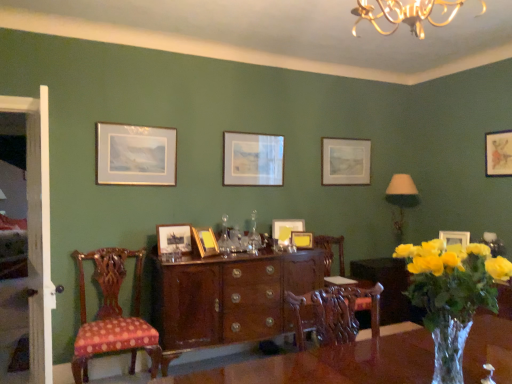
Question: In terms of size, does mahogany wood chair at center, acting as the second chair starting from the front, appear bigger or smaller than matte gold picture frame at upper right, the ninth picture frame from the left?

Choices:
 (A) small
 (B) big

Answer: (B)

Question: Is mahogany wood chair at center, the first chair viewed from the back, inside the boundaries of matte gold picture frame at upper right, the first picture frame viewed from the right, or outside?

Choices:
 (A) outside
 (B) inside

Answer: (A)

Question: Which object is positioned closest to the white wooden door at left?

Choices:
 (A) matte gold picture frame at upper right, the ninth picture frame from the left
 (B) matte silver picture frame at center, marked as the seventh picture frame in a left-to-right arrangement
 (C) wooden picture frame at center, positioned as the 7th picture frame in right-to-left order
 (D) mahogany wood chair at center, arranged as the 1th chair when viewed from the right
 (E) matte wooden picture frame at center, which is the 2th picture frame from left to right

Answer: (E)

Question: Estimate the real-world distances between objects in this image. Which object is closer to the matte gold picture frame at upper right, which is the second picture frame in right-to-left order?

Choices:
 (A) yellow matte picture frame at center, acting as the 5th picture frame starting from the left
 (B) glossy wood cabinet at center
 (C) matte wooden picture frame at center, marked as the eighth picture frame in a right-to-left arrangement
 (D) matte gold picture frame at upper right, the ninth picture frame from the left
 (E) wooden picture frame at center, positioned as the 7th picture frame in right-to-left order

Answer: (D)